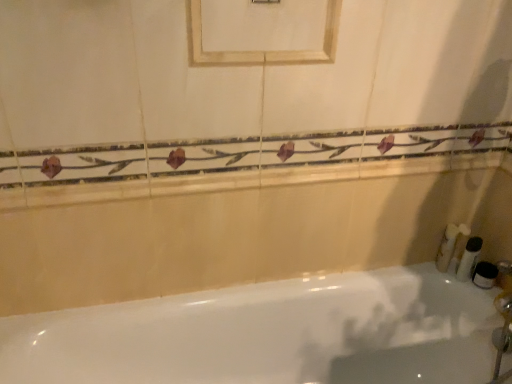
In order to click on vacant space situated on the left part of white matte toothbrushes at right, which is the 2th toiletry in left-to-right order in this screenshot , I will do `click(415, 273)`.